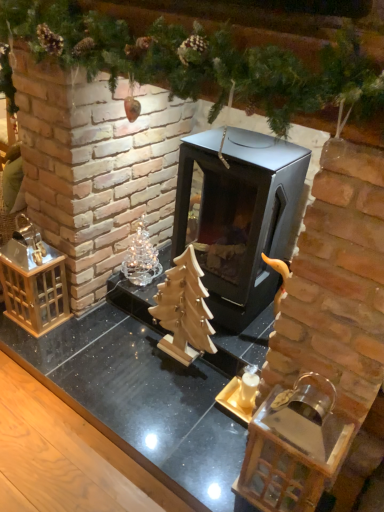
Question: Is black metal fireplace at center wider or thinner than clear glass ornament at center left?

Choices:
 (A) thin
 (B) wide

Answer: (B)

Question: Which is correct: black metal fireplace at center is inside clear glass ornament at center left, or outside of it?

Choices:
 (A) outside
 (B) inside

Answer: (A)

Question: Considering the real-world distances, which object is farthest from the clear glass ornament at center left?

Choices:
 (A) wooden christmas tree at center
 (B) black metal fireplace at center

Answer: (B)

Question: Based on their relative distances, which object is nearer to the clear glass ornament at center left?

Choices:
 (A) black metal fireplace at center
 (B) wooden christmas tree at center

Answer: (B)